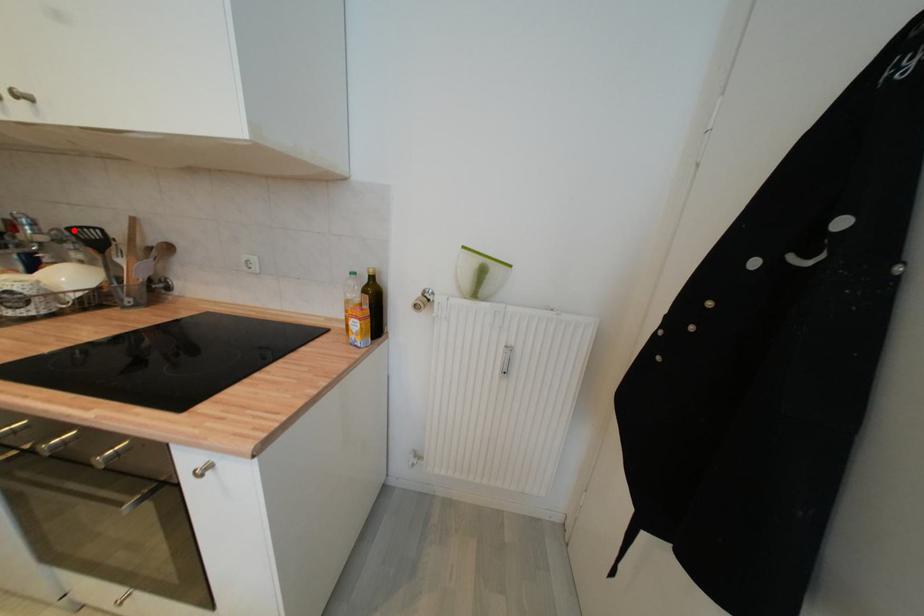
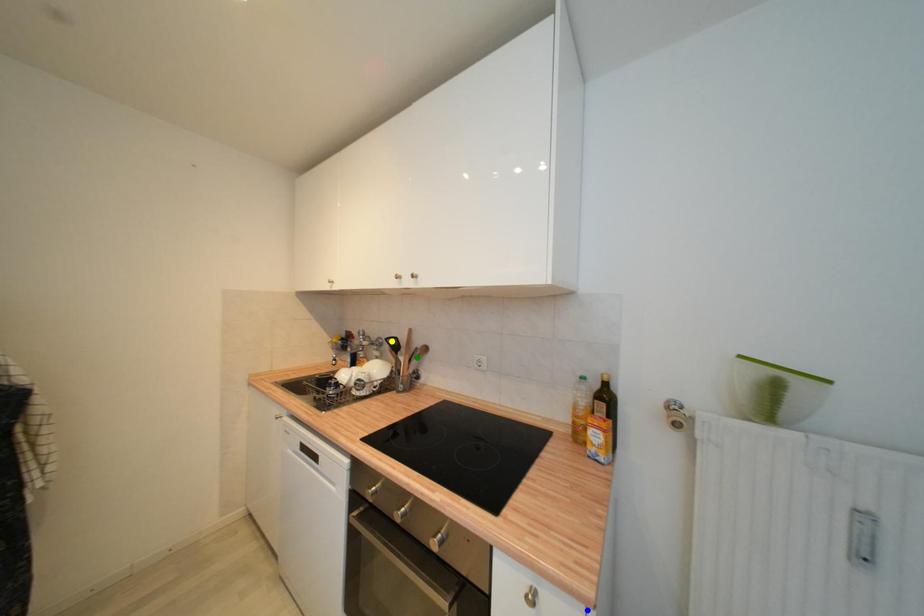
Question: I am providing you with two images of the same scene from different viewpoints. A red point is marked on the first image. You are given multiple points on the second image. Can you choose the point in image 2 that corresponds to the point in image 1?

Choices:
 (A) yellow point
 (B) blue point
 (C) green point

Answer: (A)